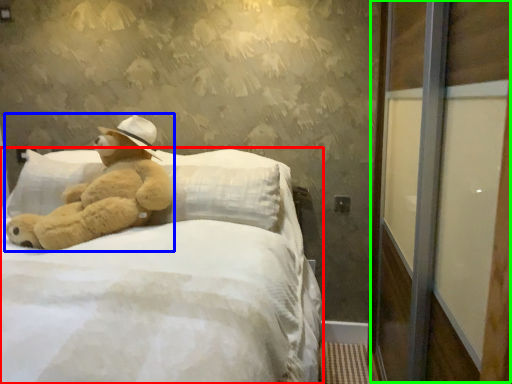
Question: Estimate the real-world distances between objects in this image. Which object is farther from bed (highlighted by a red box), teddy bear (highlighted by a blue box) or screen door (highlighted by a green box)?

Choices:
 (A) teddy bear
 (B) screen door

Answer: (B)